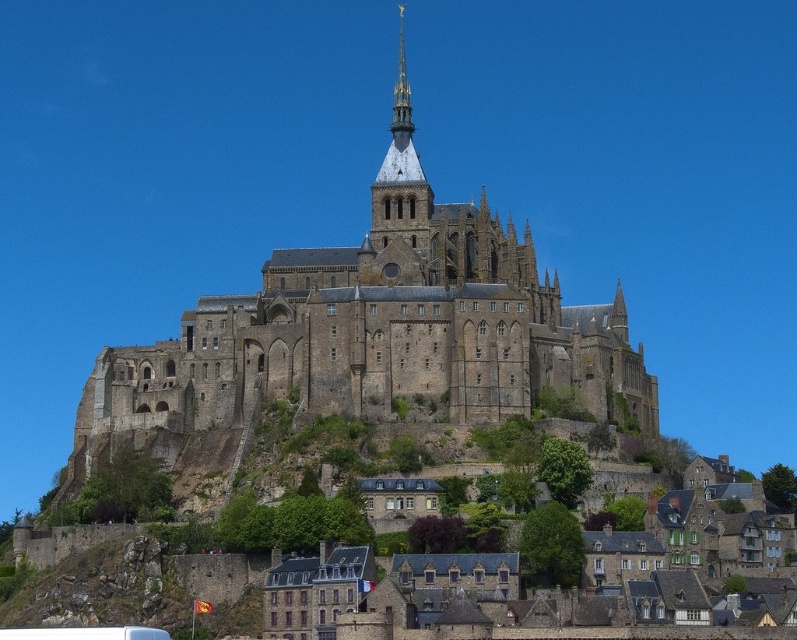
Question: Which object appears closest to the camera in this image?

Choices:
 (A) brown stone houses at lower center
 (B) brown stone castle at center

Answer: (A)

Question: Is brown stone castle at center closer to camera compared to brown stone houses at lower center?

Choices:
 (A) no
 (B) yes

Answer: (A)

Question: Observing the image, what is the correct spatial positioning of brown stone castle at center in reference to brown stone houses at lower center?

Choices:
 (A) left
 (B) right

Answer: (A)

Question: Does brown stone castle at center appear over brown stone houses at lower center?

Choices:
 (A) yes
 (B) no

Answer: (A)